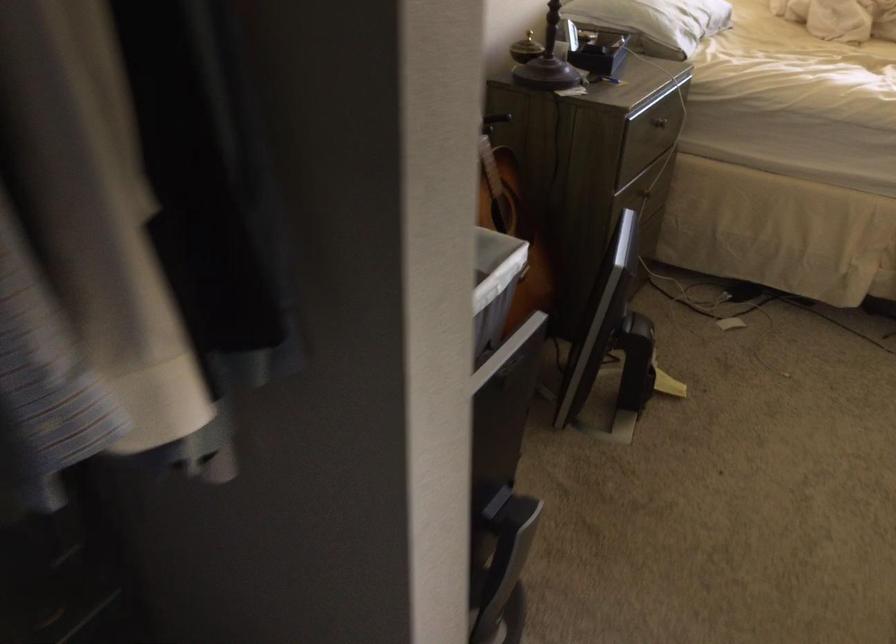
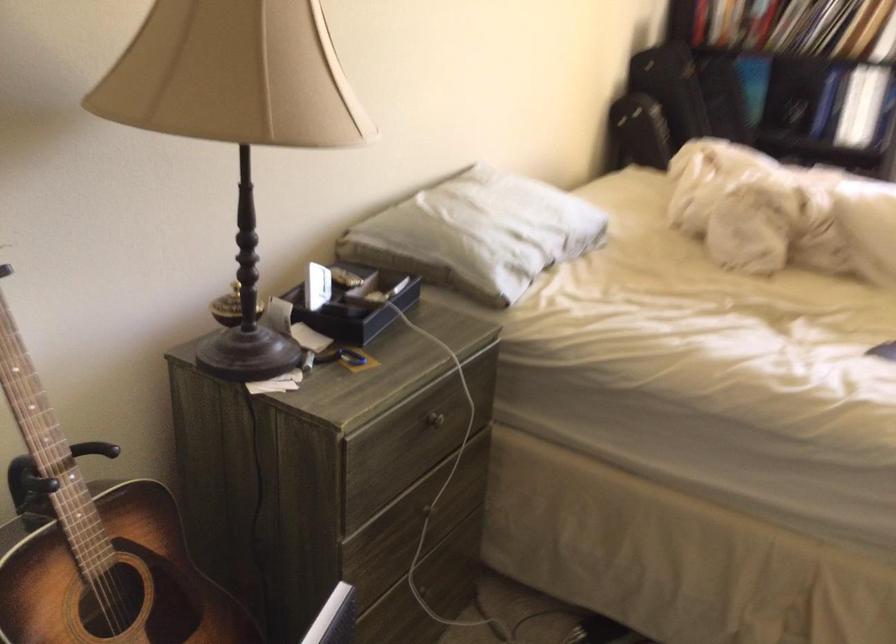
Question: Based on the continuous images, in which direction is the camera rotating? Reply with the corresponding letter.

Choices:
 (A) Left
 (B) Right
 (C) Up
 (D) Down

Answer: (C)